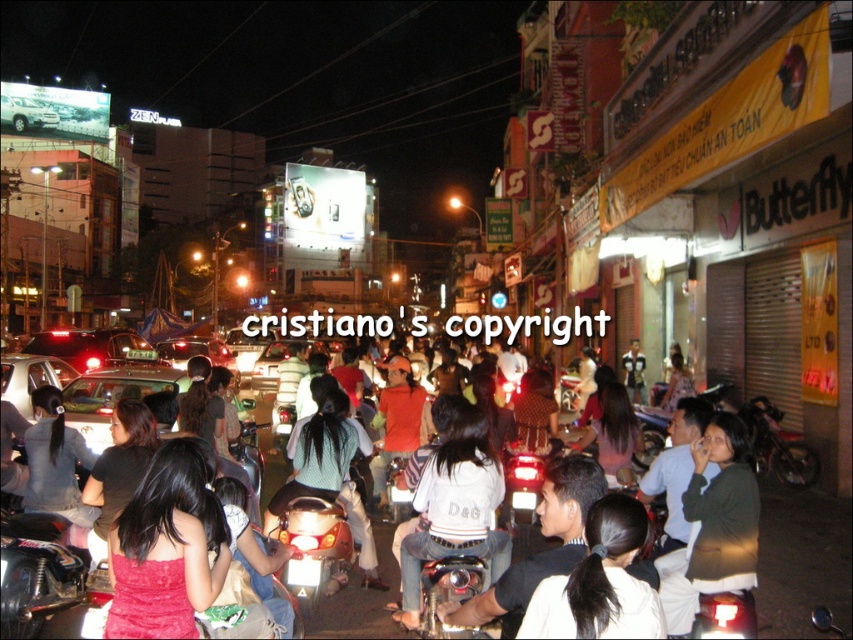
Based on the photo, you are a pedestrian trying to cross the street at night. You see a denim jacket at lower left and a matte black car at center. Which object is closer to you as you stand on the sidewalk?

The denim jacket at lower left is closer to you because it is in front of the matte black car at center.

Looking at this image, you are a pedestrian trying to cross the street at night. You see a denim jacket at lower left and a matte black car at center. Which object is closer to your left side?

The denim jacket at lower left is to the right of the matte black car at center, so the matte black car at center is closer to your left side.